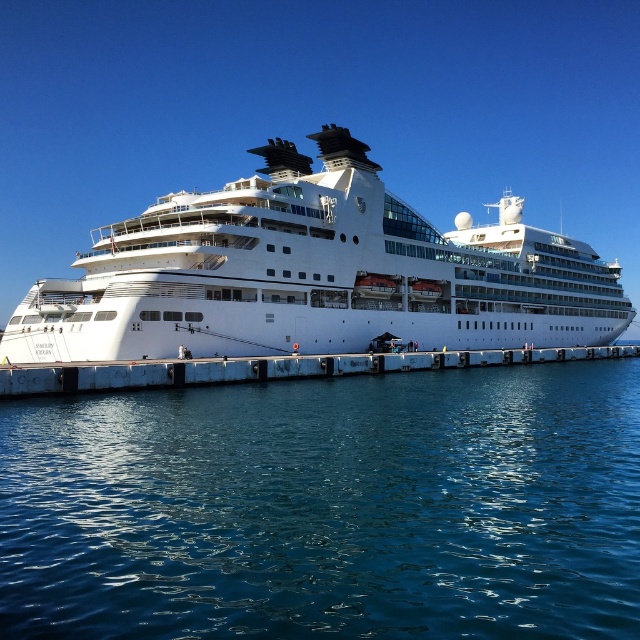
Question: Can you confirm if white glossy cruise ship at center is positioned to the left of white concrete dock at center?

Choices:
 (A) yes
 (B) no

Answer: (A)

Question: In this image, where is blue liquid water at lower center located relative to white concrete dock at center?

Choices:
 (A) below
 (B) above

Answer: (A)

Question: Which of the following is the closest to the observer?

Choices:
 (A) (253, 372)
 (B) (500, 387)

Answer: (A)

Question: Is blue liquid water at lower center further to camera compared to white glossy cruise ship at center?

Choices:
 (A) yes
 (B) no

Answer: (B)

Question: Which of the following is the closest to the observer?

Choices:
 (A) blue liquid water at lower center
 (B) white concrete dock at center
 (C) white glossy cruise ship at center

Answer: (A)

Question: Which object appears closest to the camera in this image?

Choices:
 (A) blue liquid water at lower center
 (B) white glossy cruise ship at center
 (C) white concrete dock at center

Answer: (A)